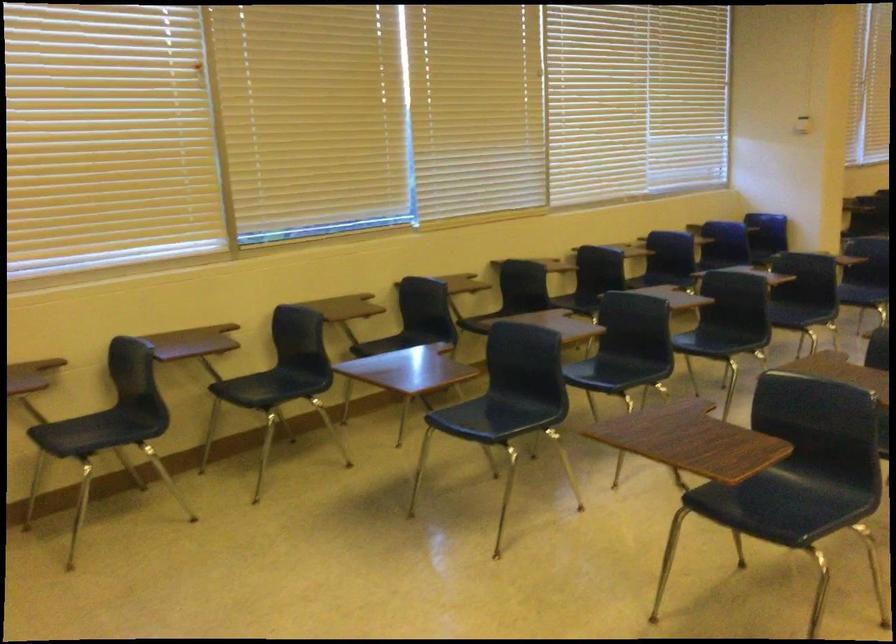
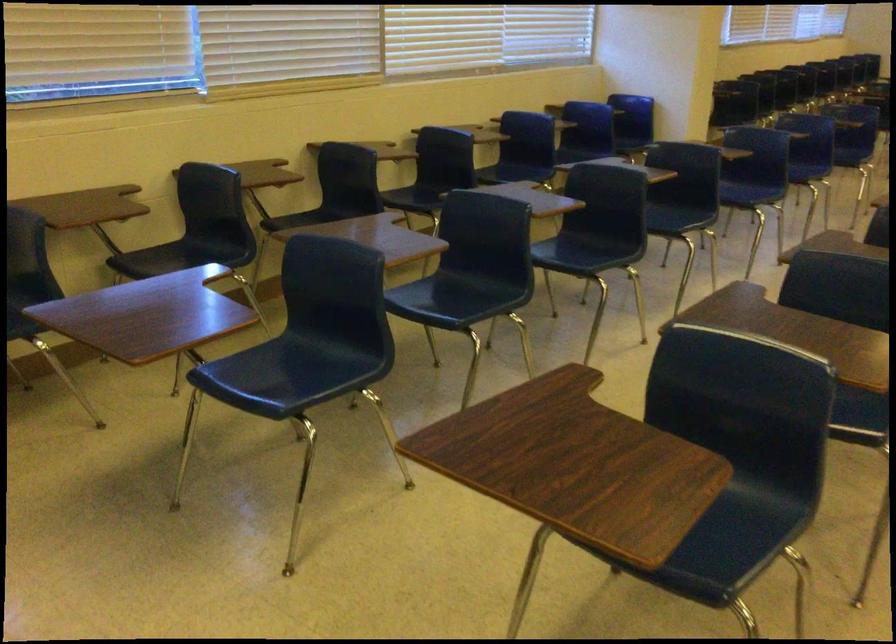
Locate, in the second image, the point that corresponds to the point at 719,337 in the first image.

(586, 252)